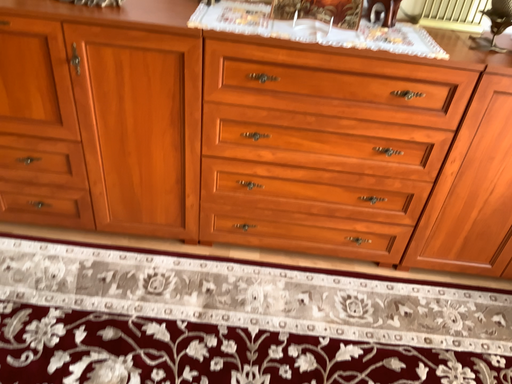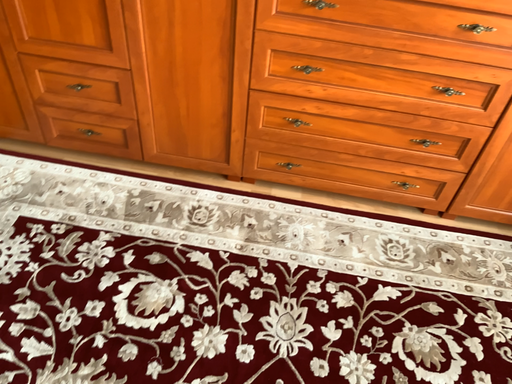
Question: Which way did the camera rotate in the video?

Choices:
 (A) rotated upward
 (B) rotated downward

Answer: (B)